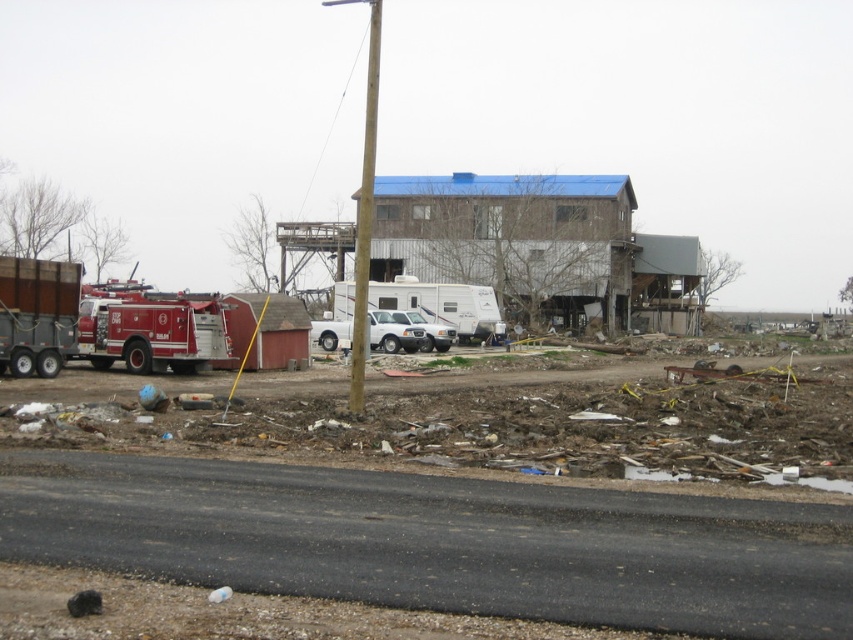
Based on the photo, does matte brown trailer truck at left have a greater width compared to white matte truck at center?

Yes, matte brown trailer truck at left is wider than white matte truck at center.

Does point (73, 272) come in front of point (403, 316)?

That is True.

Image resolution: width=853 pixels, height=640 pixels. In order to click on matte brown trailer truck at left in this screenshot , I will do `click(36, 314)`.

Which is above, shiny red fire truck at left or matte brown trailer truck at left?

shiny red fire truck at left

Does shiny red fire truck at left appear on the right side of matte brown trailer truck at left?

In fact, shiny red fire truck at left is to the left of matte brown trailer truck at left.

Image resolution: width=853 pixels, height=640 pixels. I want to click on shiny red fire truck at left, so [149, 326].

Is shiny red fire truck at left wider than white matte truck at center?

Indeed, shiny red fire truck at left has a greater width compared to white matte truck at center.

Who is lower down, shiny red fire truck at left or white matte truck at center?

white matte truck at center

The height and width of the screenshot is (640, 853). I want to click on shiny red fire truck at left, so click(x=149, y=326).

Where is `shiny red fire truck at left`? shiny red fire truck at left is located at coordinates (149, 326).